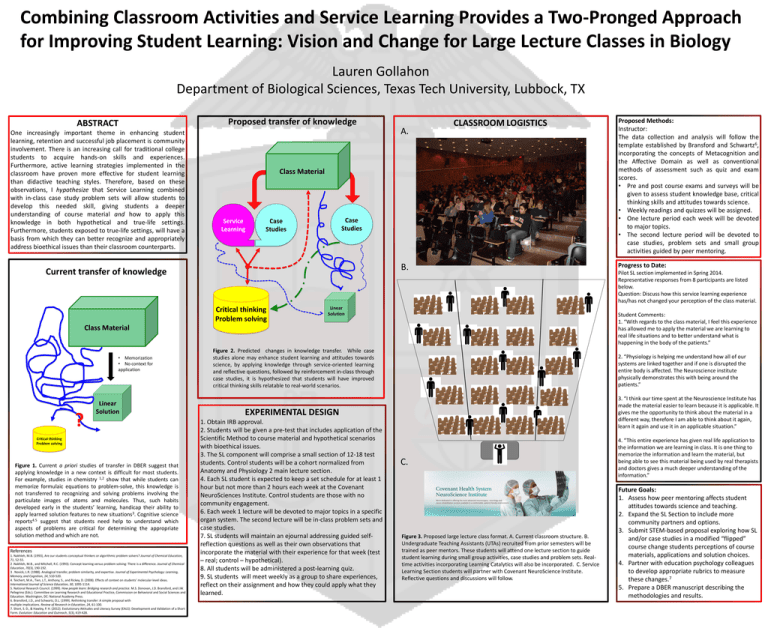
Where is `auditorium`? This screenshot has height=628, width=768. auditorium is located at coordinates (451, 171).